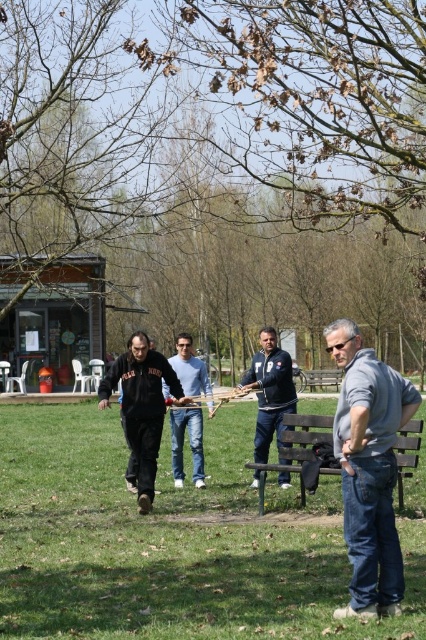
You are a photographer trying to capture a photo of the blue denim jacket at center and the brown wooden bench at center. Which object should you zoom in on to make them appear the same size in the photo?

The blue denim jacket at center is bigger than the brown wooden bench at center, so you should zoom in on the brown wooden bench at center to make them appear the same size in the photo.

You are a photographer standing in the park and want to take a photo of the blue denim jacket at center and the brown wooden bench at center. Can you fit both in your camera frame if the maximum width your camera can capture is 12 inches?

The blue denim jacket at center and brown wooden bench at center are 12.90 inches apart from each other. Since the distance between them exceeds the camera frame width of 12 inches, you cannot fit both in the frame.

You are standing at the point with coordinates point (106,401) and want to walk to the point with coordinates point (403,451). Given that the path between them is straight, will you be moving towards the background or the foreground of the image?

Since point (106,401) is closer to the viewer than point (403,451), moving from point (106,401) to point (403,451) would mean moving towards the background of the image.